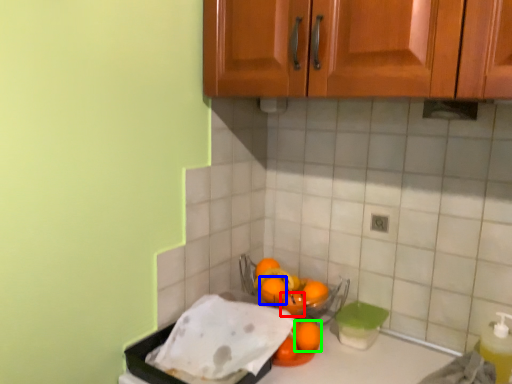
Question: Which object is the farthest from orange (highlighted by a red box)? Choose among these: orange (highlighted by a blue box) or orange (highlighted by a green box).

Choices:
 (A) orange
 (B) orange

Answer: (B)